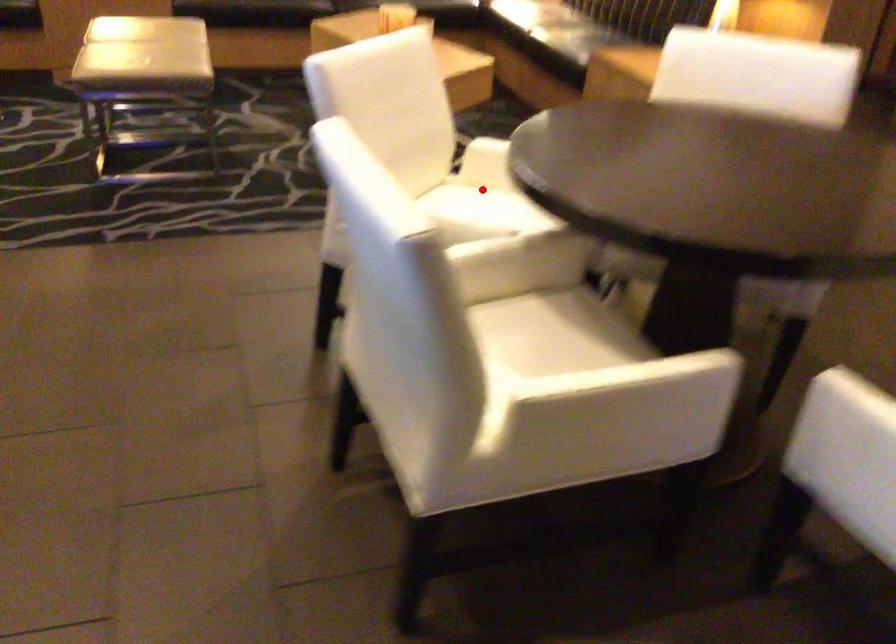
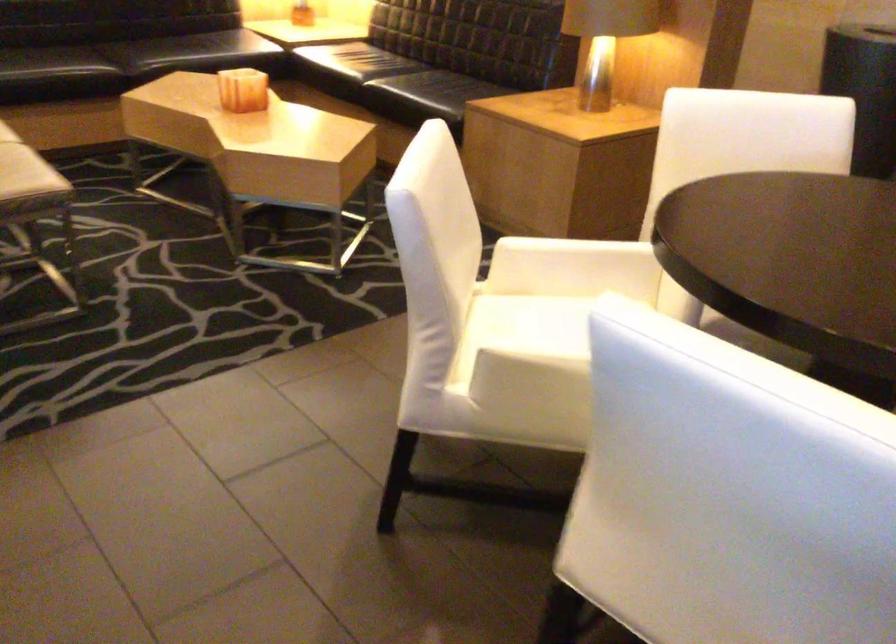
Find the pixel in the second image that matches the highlighted location in the first image.

(538, 304)